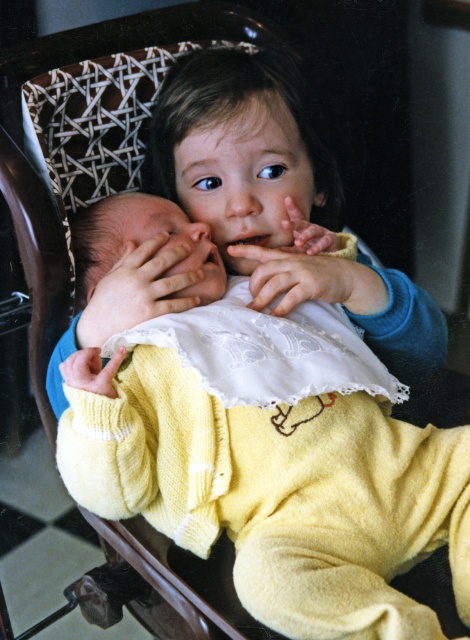
Question: Considering the relative positions of yellow knitted sweater at center and smooth skin hand at center in the image provided, where is yellow knitted sweater at center located with respect to smooth skin hand at center?

Choices:
 (A) above
 (B) below

Answer: (B)

Question: Which point is closer to the camera?

Choices:
 (A) smooth skin hand at center
 (B) yellow knitted sweater at center

Answer: (B)

Question: Is yellow knitted sweater at center below smooth skin hand at center?

Choices:
 (A) yes
 (B) no

Answer: (A)

Question: Is the position of yellow knitted sweater at center more distant than that of smooth skin hand at center?

Choices:
 (A) yes
 (B) no

Answer: (B)

Question: Which point is farther to the camera?

Choices:
 (A) smooth skin hand at center
 (B) yellow knitted sweater at center

Answer: (A)